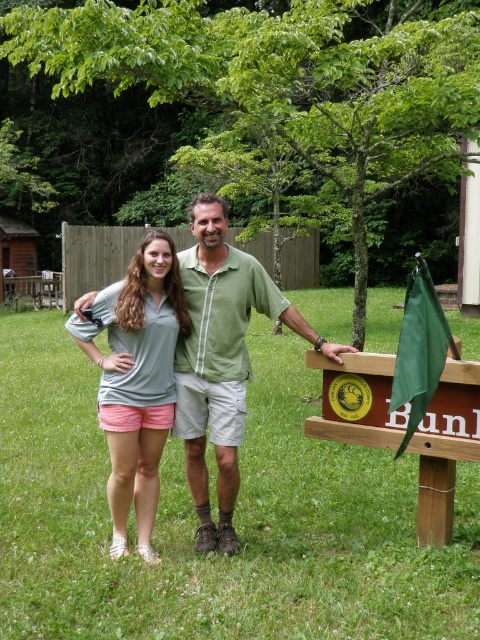
You are a photographer trying to capture a group photo of the green matte shirt at center and the matte gray shirt at center. Based on their heights, which one should you position closer to the front to ensure both are visible in the photo?

The matte gray shirt at center is shorter, so you should position the matte gray shirt at center in the front and the green matte shirt at center at the back to ensure both are visible in the photo.